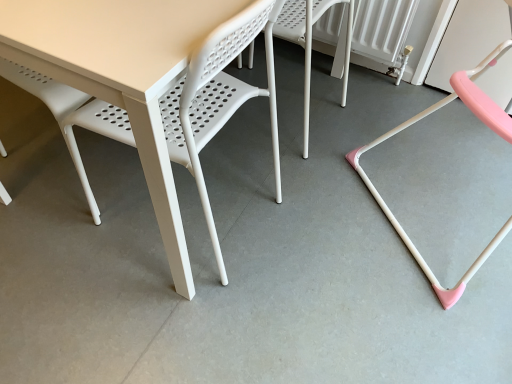
What are the coordinates of `vacant region under pink plastic chair at right, the first chair when ordered from right to left (from a real-world perspective)` in the screenshot? It's located at (451, 195).